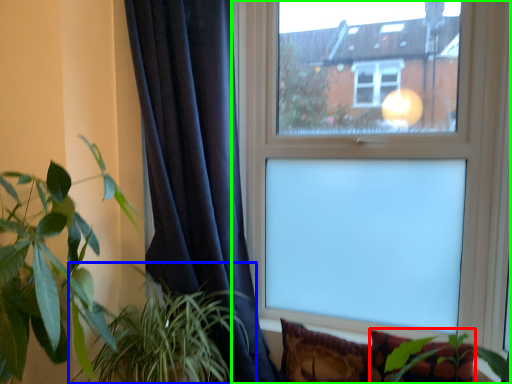
Question: Estimate the real-world distances between objects in this image. Which object is closer to pillow (highlighted by a red box), houseplant (highlighted by a blue box) or window (highlighted by a green box)?

Choices:
 (A) houseplant
 (B) window

Answer: (B)